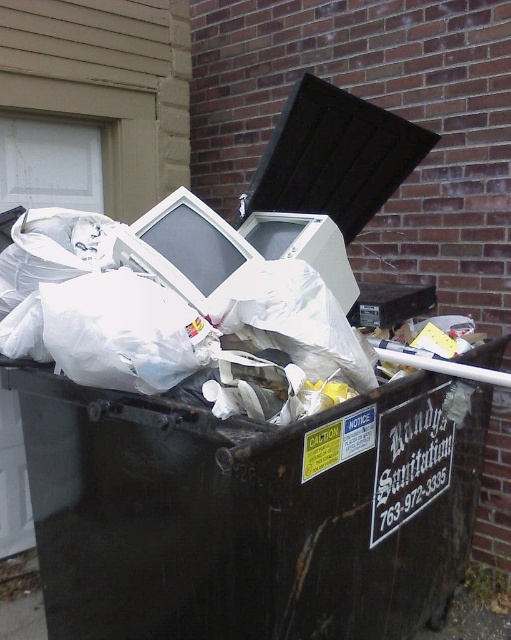
Question: Which of the following is the farthest from the observer?

Choices:
 (A) matte white monitor at center
 (B) matte plastic computer monitor at center

Answer: (B)

Question: Is matte white monitor at center in front of matte plastic computer monitor at center?

Choices:
 (A) yes
 (B) no

Answer: (A)

Question: Can you confirm if matte white monitor at center is thinner than matte plastic computer monitor at center?

Choices:
 (A) yes
 (B) no

Answer: (B)

Question: Which object is farther from the camera taking this photo?

Choices:
 (A) matte plastic computer monitor at center
 (B) matte white monitor at center

Answer: (A)

Question: Does matte white monitor at center have a smaller size compared to matte plastic computer monitor at center?

Choices:
 (A) no
 (B) yes

Answer: (A)